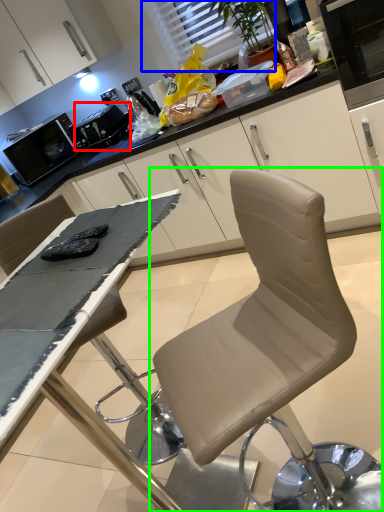
Question: Which object is positioned farthest from appliance (highlighted by a red box)? Select from window (highlighted by a blue box) and chair (highlighted by a green box).

Choices:
 (A) window
 (B) chair

Answer: (B)